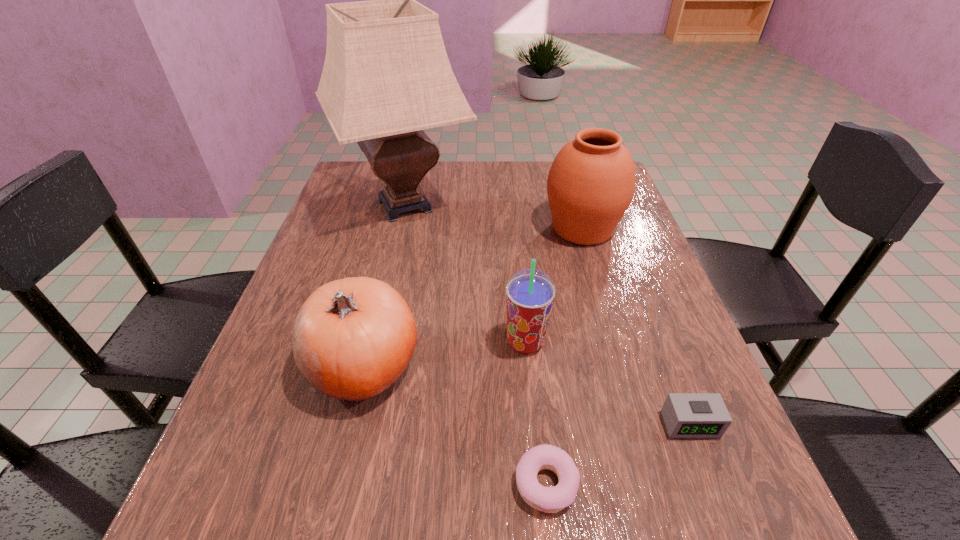
Locate an element on the screen. lampshade is located at coordinates (386, 77).

Locate an element on the screen. The image size is (960, 540). urn is located at coordinates (591, 183).

At what (x,y) coordinates should I click in order to perform the action: click on smoothie. Please return your answer as a coordinate pair (x, y). The width and height of the screenshot is (960, 540). Looking at the image, I should click on (530, 293).

Where is `pumpkin`? The width and height of the screenshot is (960, 540). pumpkin is located at coordinates (353, 338).

Image resolution: width=960 pixels, height=540 pixels. What are the coordinates of `alarm clock` in the screenshot? It's located at (686, 415).

Identify the location of the shortest object. The width and height of the screenshot is (960, 540). (546, 499).

You are a GUI agent. You are given a task and a screenshot of the screen. Output one action in this format:
    pyautogui.click(x=<x>, y=<y>)
    Task: Click on the doughnut
    
    Given the screenshot: What is the action you would take?
    pyautogui.click(x=546, y=499)

You are a GUI agent. You are given a task and a screenshot of the screen. Output one action in this format:
    pyautogui.click(x=<x>, y=<y>)
    Task: Click on the free location located 0.240m on the front of the tallest object
    Image resolution: width=960 pixels, height=540 pixels.
    Given the screenshot: What is the action you would take?
    click(x=377, y=327)

Identify the location of vacant space situated on the back of the second tallest object. The image size is (960, 540). (566, 176).

Find the location of a particular element. The height and width of the screenshot is (540, 960). vacant position located on the left of the smoothie is located at coordinates (388, 342).